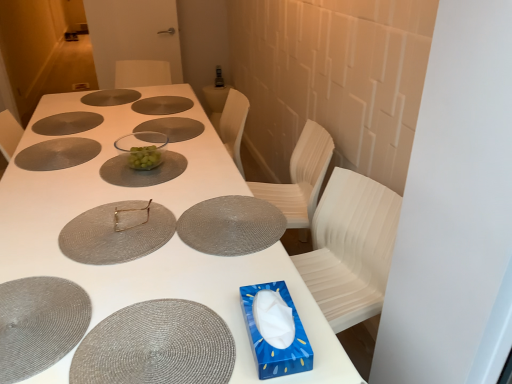
Image resolution: width=512 pixels, height=384 pixels. Identify the location of free area in between matte gray glass plate at upper left, the third glass plate in the back-to-front sequence, and matte gray placemat at center, the 8th glass plate positioned from the back. (80, 162).